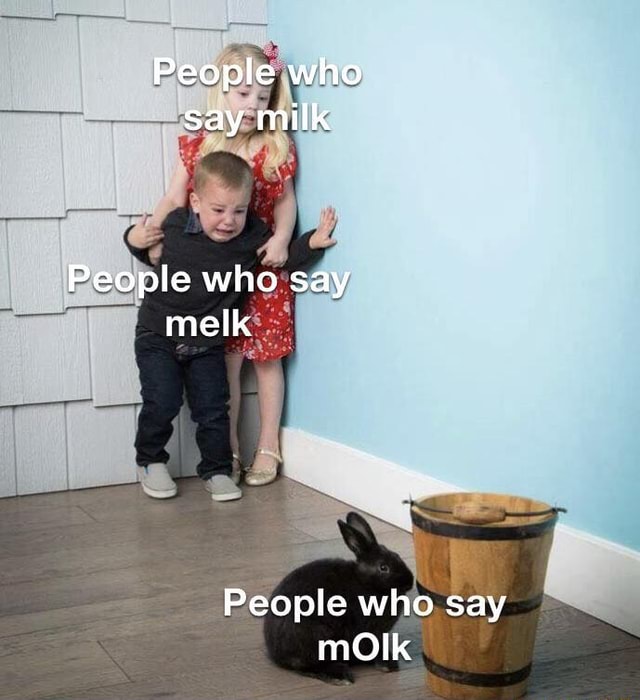
In order to click on large tiles on wall in this screenshot , I will do `click(27, 256)`, `click(43, 69)`, `click(122, 52)`, `click(27, 194)`, `click(93, 256)`, `click(52, 362)`, `click(116, 358)`.